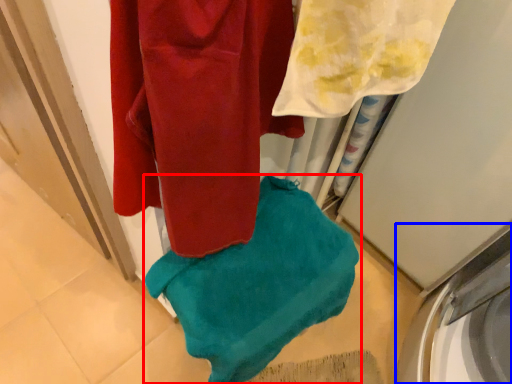
Question: Which point is further to the camera, towel (highlighted by a red box) or washing machine (highlighted by a blue box)?

Choices:
 (A) towel
 (B) washing machine

Answer: (B)